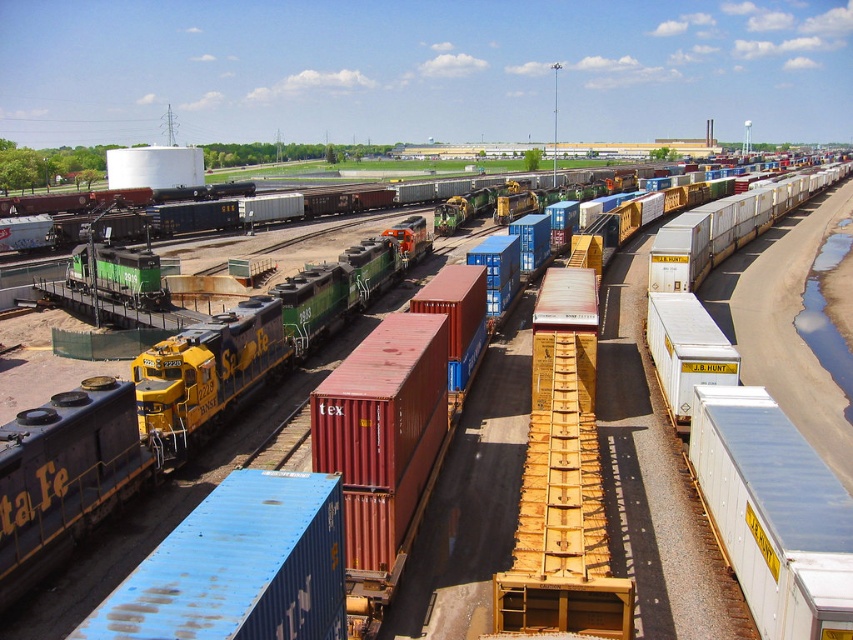
You are standing in the rail yard and want to walk from the point at coordinates (216, 346) to the point at coordinates (297, 499). Which direction should you move to get closer to your destination?

Since point (216, 346) is closer to you than point (297, 499), you should move away from your current position towards the background to reach the destination point (297, 499).

You are a worker in the rail yard and need to load a large cargo onto the yellow matte train car at lower left and the blue matte container at center. Based on their sizes, which one can accommodate the large cargo?

The yellow matte train car at lower left is larger in size than the blue matte container at center, so it can accommodate the large cargo.

You are a maintenance worker needing to access the blue matte container at center. The yellow matte train car at lower left is blocking your path. Can you move the container without moving the train car?

The yellow matte train car at lower left is positioned over the blue matte container at center, so you cannot move the container without moving the train car first.